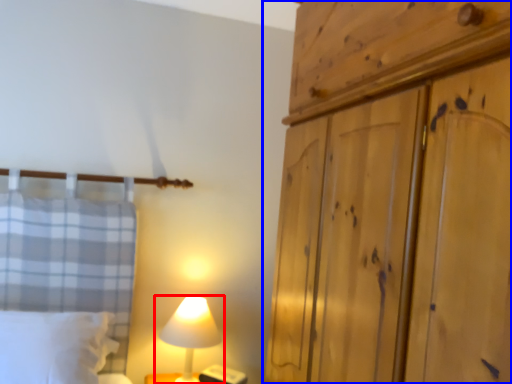
Question: Which point is further to the camera, lamp (highlighted by a red box) or cupboard (highlighted by a blue box)?

Choices:
 (A) lamp
 (B) cupboard

Answer: (A)